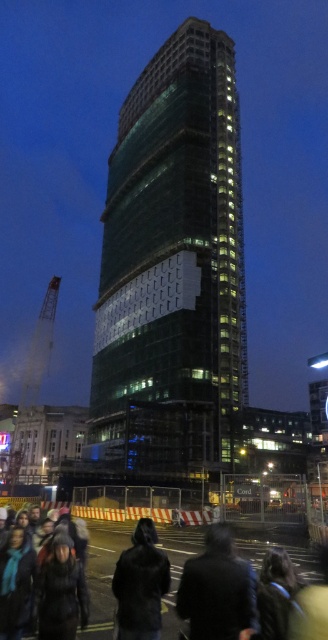
Does dark fur coat at lower center have a larger size compared to metallic yellow crane at left?

Incorrect, dark fur coat at lower center is not larger than metallic yellow crane at left.

Can you confirm if dark fur coat at lower center is positioned below metallic yellow crane at left?

No, dark fur coat at lower center is not below metallic yellow crane at left.

The width and height of the screenshot is (328, 640). Find the location of `dark fur coat at lower center`. dark fur coat at lower center is located at coordinates (141, 584).

Is the position of dark brown leather jacket at lower center more distant than that of black wool coat at lower center?

Yes.

Which is behind, point (98, 541) or point (212, 560)?

The point (98, 541) is more distant.

I want to click on dark brown leather jacket at lower center, so click(102, 573).

Is green glass tower at center wider than metallic yellow crane at left?

Incorrect, green glass tower at center's width does not surpass metallic yellow crane at left's.

Is green glass tower at center positioned in front of metallic yellow crane at left?

That is True.

You are a GUI agent. You are given a task and a screenshot of the screen. Output one action in this format:
    pyautogui.click(x=<x>, y=<y>)
    Task: Click on the green glass tower at center
    The image size is (328, 640).
    Given the screenshot: What is the action you would take?
    pos(175,253)